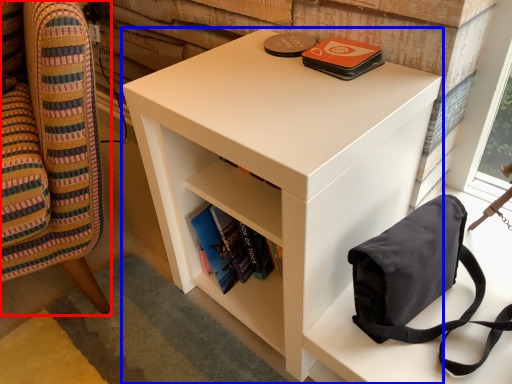
Question: Which object appears closest to the camera in this image, furniture (highlighted by a red box) or nightstand (highlighted by a blue box)?

Choices:
 (A) furniture
 (B) nightstand

Answer: (A)